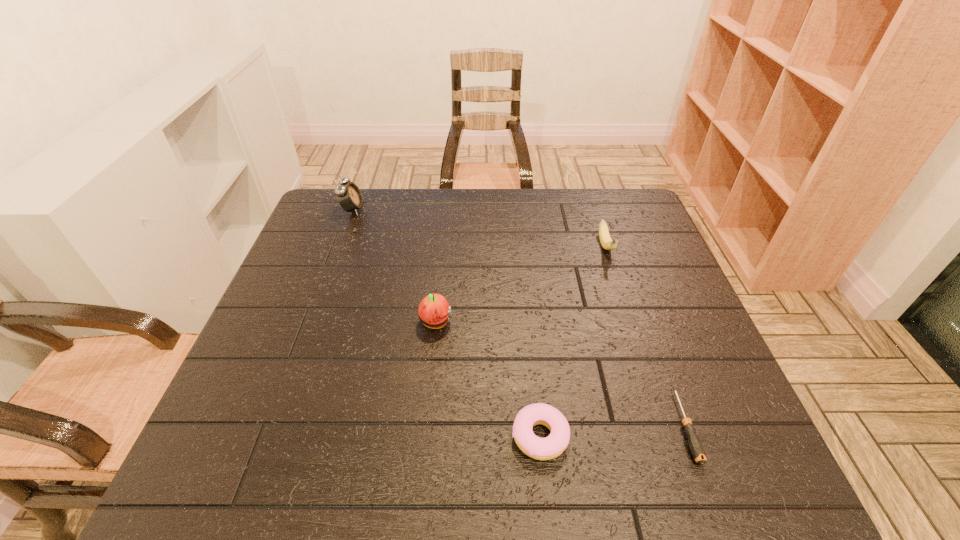
Find the location of `banana that is at the right edge`. banana that is at the right edge is located at coordinates (607, 243).

Locate an element on the screen. The image size is (960, 540). screwdriver present at the right edge is located at coordinates (696, 447).

Locate an element on the screen. This screenshot has height=540, width=960. object at the far left corner is located at coordinates (349, 196).

Identify the location of object present at the far right corner. (607, 243).

Image resolution: width=960 pixels, height=540 pixels. Find the location of `object present at the near right corner`. object present at the near right corner is located at coordinates (696, 447).

I want to click on vacant region at the far edge, so click(584, 219).

At what (x,y) coordinates should I click in order to perform the action: click on vacant space at the near edge of the desktop. Please return your answer as a coordinate pair (x, y). This screenshot has height=540, width=960. Looking at the image, I should click on (649, 485).

The height and width of the screenshot is (540, 960). I want to click on vacant point at the left edge, so click(x=280, y=429).

Where is `vacant point at the right edge`? vacant point at the right edge is located at coordinates (668, 434).

Locate an element on the screen. This screenshot has width=960, height=540. blank space at the far left corner of the desktop is located at coordinates (341, 221).